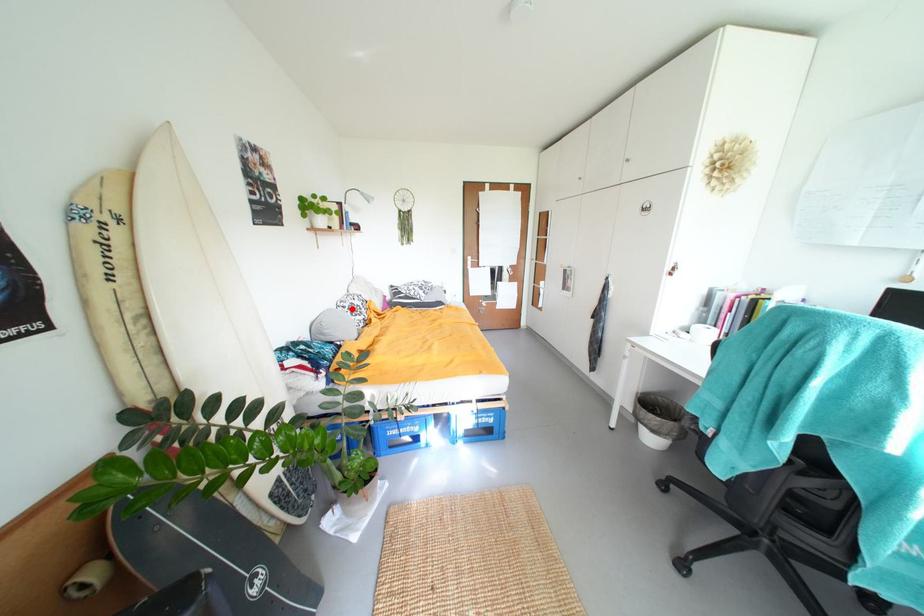
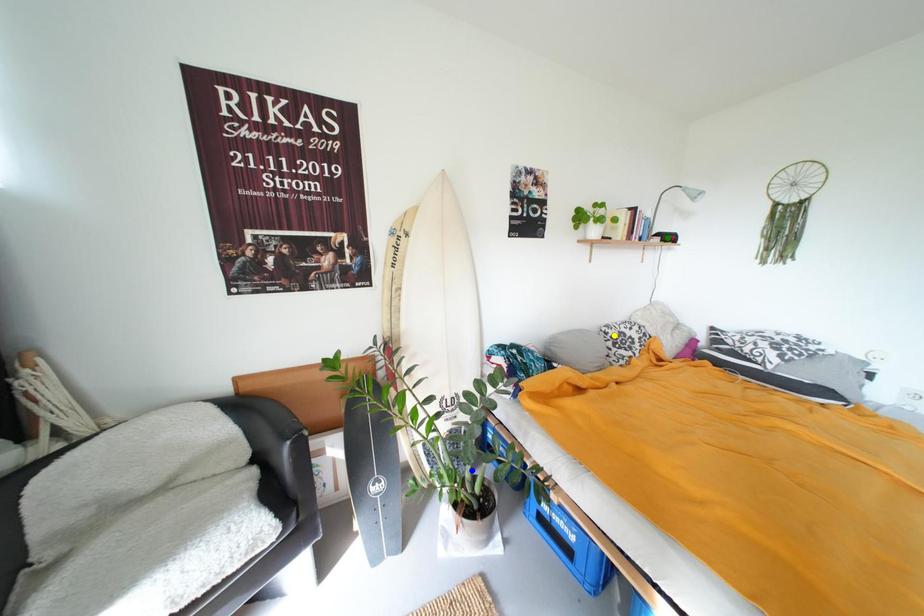
Question: I am providing you with two images of the same scene from different viewpoints. A red point is marked on the first image. You are given multiple points on the second image. Which point in image 2 is actually the same real-world point as the red point in image 1?

Choices:
 (A) blue point
 (B) green point
 (C) yellow point

Answer: (C)